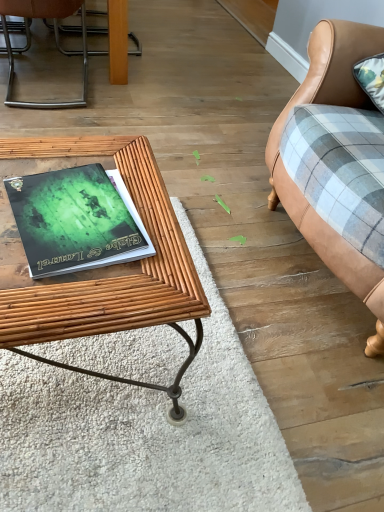
At what (x,y) coordinates should I click in order to perform the action: click on vacant area on top of green matte book at center (from a real-world perspective). Please return your answer as a coordinate pair (x, y). Looking at the image, I should click on (83, 209).